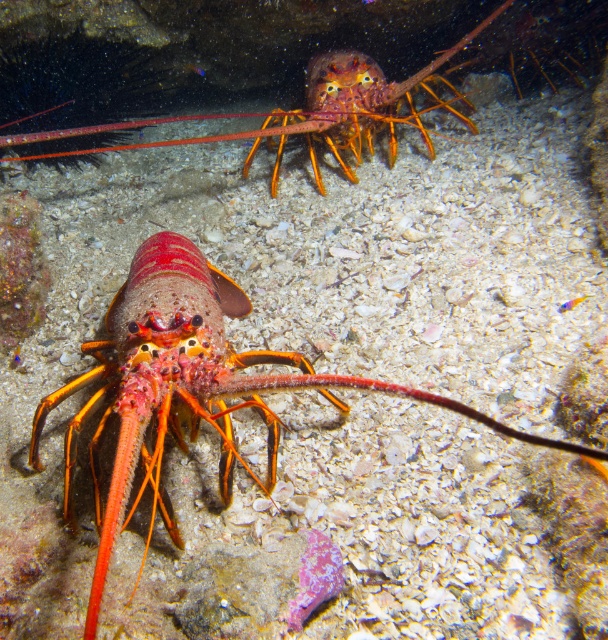
You are a marine biologist observing underwater life. You notice a point marked at coordinates (185, 380). Based on the scene, what object is located at that point?

The point at (185, 380) indicates the shiny orange lobster at center.